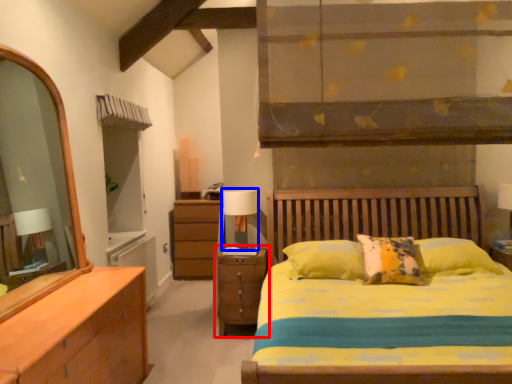
Question: Which object appears closest to the camera in this image, nightstand (highlighted by a red box) or table lamp (highlighted by a blue box)?

Choices:
 (A) nightstand
 (B) table lamp

Answer: (A)